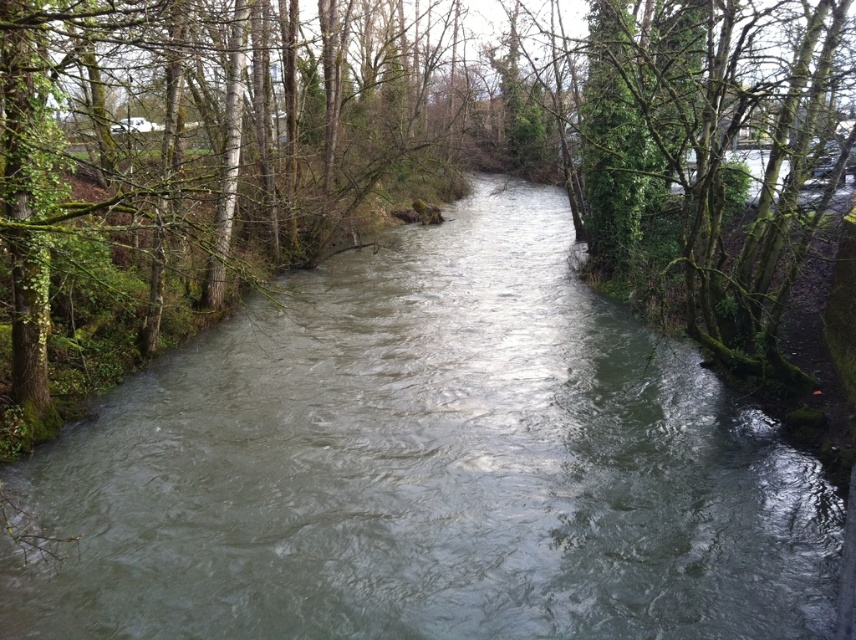
Can you confirm if gray/rough water at center is taller than green mossy tree at center?

In fact, gray/rough water at center may be shorter than green mossy tree at center.

Describe the element at coordinates (429, 467) in the screenshot. I see `gray/rough water at center` at that location.

Image resolution: width=856 pixels, height=640 pixels. I want to click on gray/rough water at center, so 429,467.